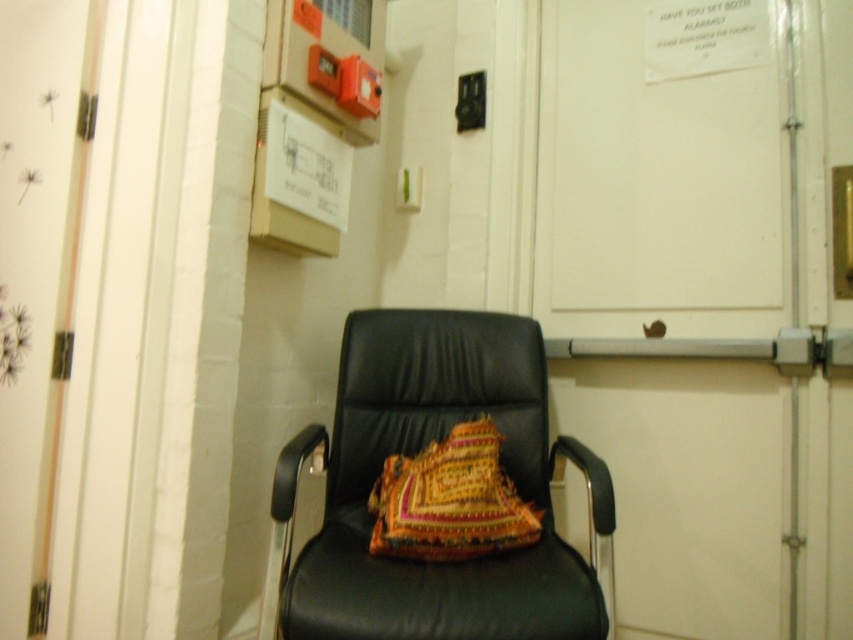
Question: Among these objects, which one is farthest from the camera?

Choices:
 (A) multicolored knitted pillow at center
 (B) black leather swivel chair at center

Answer: (A)

Question: Can you confirm if black leather swivel chair at center is smaller than multicolored knitted pillow at center?

Choices:
 (A) yes
 (B) no

Answer: (B)

Question: Does black leather swivel chair at center have a greater width compared to multicolored knitted pillow at center?

Choices:
 (A) yes
 (B) no

Answer: (A)

Question: Does black leather swivel chair at center have a larger size compared to multicolored knitted pillow at center?

Choices:
 (A) yes
 (B) no

Answer: (A)